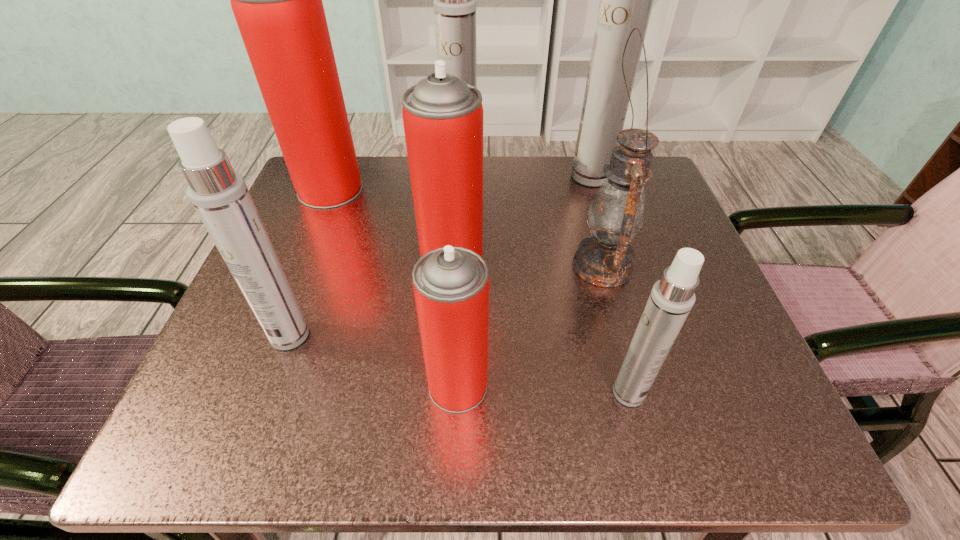
Locate an element on the screen. Image resolution: width=960 pixels, height=540 pixels. aerosol can at the right edge is located at coordinates pyautogui.click(x=626, y=0).

Find the location of a particular element. The width and height of the screenshot is (960, 540). oil lamp present at the right edge is located at coordinates (617, 212).

At what (x,y) coordinates should I click in order to perform the action: click on object that is at the far left corner. Please return your answer as a coordinate pair (x, y). Image resolution: width=960 pixels, height=540 pixels. Looking at the image, I should click on (277, 2).

The width and height of the screenshot is (960, 540). Identify the location of object at the far right corner. (626, 0).

The height and width of the screenshot is (540, 960). What are the coordinates of `free space at the far edge` in the screenshot? It's located at (495, 206).

In the image, there is a desktop. In order to click on vacant space at the near edge in this screenshot , I will do `click(453, 423)`.

The image size is (960, 540). Identify the location of blank area at the left edge. (214, 363).

The image size is (960, 540). Find the location of `vacant space at the right edge of the desktop`. vacant space at the right edge of the desktop is located at coordinates (675, 349).

Find the location of a particular element. The width and height of the screenshot is (960, 540). free space at the far left corner of the desktop is located at coordinates (365, 207).

This screenshot has height=540, width=960. Identify the location of free space at the near left corner of the desktop. (168, 443).